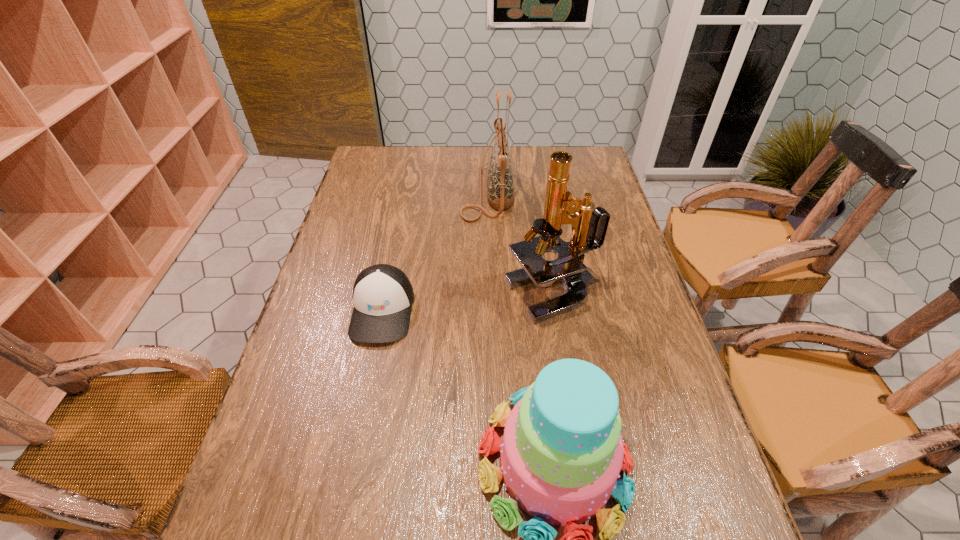
Where is `vacant space located on the front-facing side of the farthest object`? vacant space located on the front-facing side of the farthest object is located at coordinates (354, 191).

I want to click on vacant space located on the front panel of the cap, so click(366, 390).

Identify the location of object located at the far edge. The width and height of the screenshot is (960, 540). (500, 194).

Find the location of a particular element. Image resolution: width=960 pixels, height=540 pixels. object at the left edge is located at coordinates (383, 296).

The image size is (960, 540). In order to click on object that is at the right edge in this screenshot , I will do `click(568, 269)`.

The height and width of the screenshot is (540, 960). I want to click on vacant point at the far edge, so click(424, 166).

The image size is (960, 540). I want to click on free location at the left edge of the desktop, so click(x=365, y=185).

Image resolution: width=960 pixels, height=540 pixels. Identify the location of vacant area at the right edge. (654, 385).

At what (x,y) coordinates should I click in order to perform the action: click on vacant space at the far right corner of the desktop. Please return your answer as a coordinate pair (x, y). Looking at the image, I should click on (554, 147).

The image size is (960, 540). I want to click on vacant area between the shortest object and the microscope, so click(468, 302).